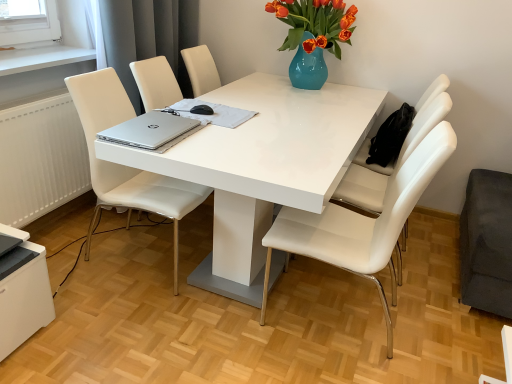
Where is `vacant space behind white glossy desktop at lower left`? Image resolution: width=512 pixels, height=384 pixels. vacant space behind white glossy desktop at lower left is located at coordinates (71, 279).